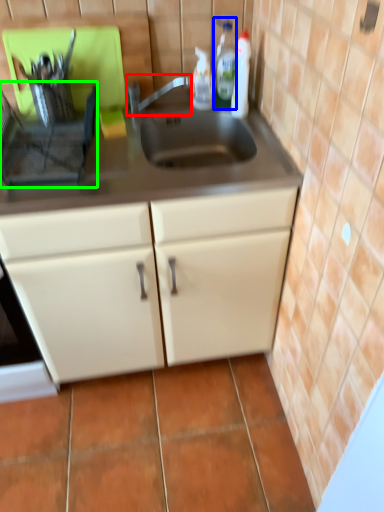
Question: Considering the real-world distances, which object is closest to faucet (highlighted by a red box)? bottle (highlighted by a blue box) or appliance (highlighted by a green box).

Choices:
 (A) bottle
 (B) appliance

Answer: (A)